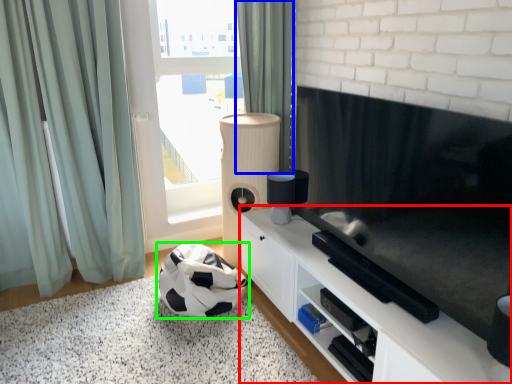
Question: Which object is positioned closest to cabinetry (highlighted by a red box)? Select from curtain (highlighted by a blue box) and football (highlighted by a green box).

Choices:
 (A) curtain
 (B) football

Answer: (B)